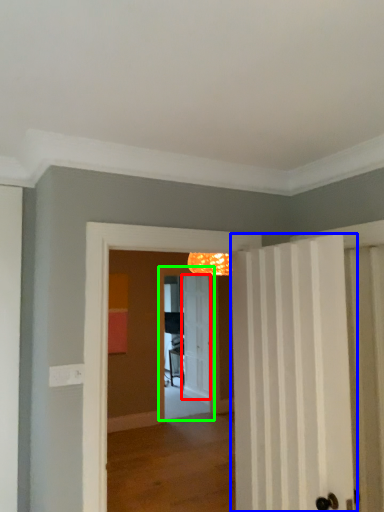
Question: Based on their relative distances, which object is nearer to door (highlighted by a red box)? Choose from door (highlighted by a blue box) and screen door (highlighted by a green box).

Choices:
 (A) door
 (B) screen door

Answer: (B)